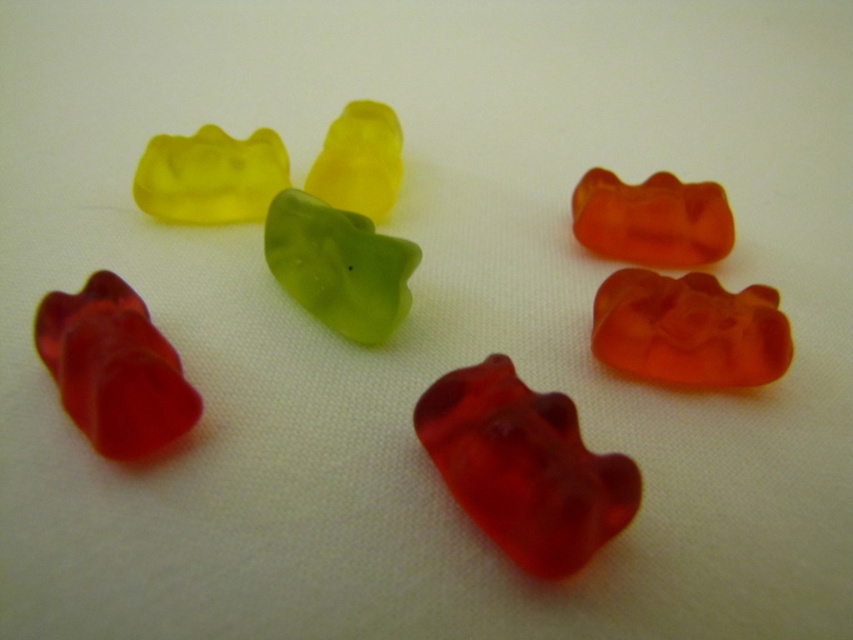
You are a child trying to grab the yellow translucent bear at upper left from the arrangement. Which direction should you move your hand relative to the translucent red gummy bear at center to reach it?

The yellow translucent bear at upper left is above the translucent red gummy bear at center, so you should move your hand upward from the translucent red gummy bear at center to reach the yellow translucent bear at upper left.

You are a child trying to choose the wider gummy bear between the translucent red gummy bear at center and the yellow translucent bear at upper left. Which one should you pick?

The translucent red gummy bear at center is wider than the yellow translucent bear at upper left, so you should pick the translucent red gummy bear at center.

You are a child looking at the gummy bears on the table. There are two points marked on the table where the gummy bears are placed. The first point is at coordinate (751, 312) and the second is at (712, 204). If you want to pick up the gummy bear closest to you, which point should you reach for?

Point (751, 312) is in front of point (712, 204), so you should reach for the gummy bear at point (751, 312) as it is closer to you.